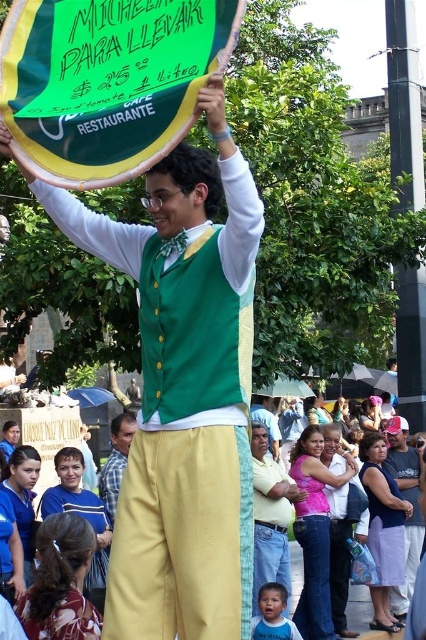
Question: Can you confirm if blue plaid shirt at center is thinner than smooth blue shirt at center?

Choices:
 (A) no
 (B) yes

Answer: (B)

Question: Considering the real-world distances, which object is closest to the light brown leather shirt at center?

Choices:
 (A) pink fabric at center
 (B) smooth blue shirt at center

Answer: (A)

Question: Estimate the real-world distances between objects in this image. Which object is farther from the blue plaid shirt at center?

Choices:
 (A) light brown leather shirt at center
 (B) pink fabric at center
 (C) yellow fabric pants at center

Answer: (B)

Question: Does light brown leather shirt at center appear on the right side of smooth blue shirt at lower center?

Choices:
 (A) yes
 (B) no

Answer: (A)

Question: Which point appears closest to the camera in this image?

Choices:
 (A) (354, 598)
 (B) (391, 544)
 (C) (276, 625)
 (D) (262, 404)

Answer: (C)

Question: Is light brown leather shirt at center further to camera compared to smooth blue shirt at lower center?

Choices:
 (A) yes
 (B) no

Answer: (B)